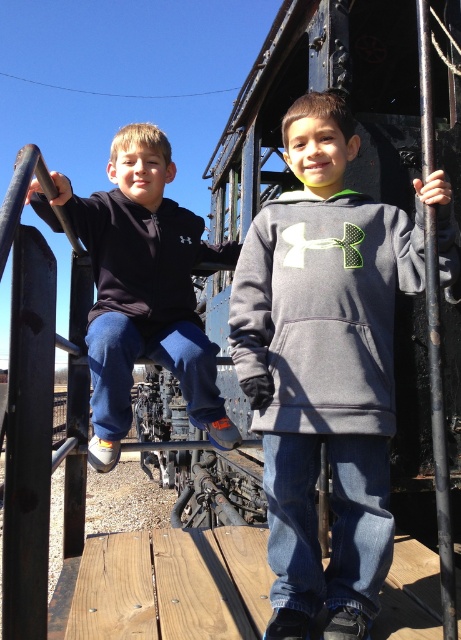
Question: Is gray fleece sweatshirt at center in front of black metal pole at right?

Choices:
 (A) no
 (B) yes

Answer: (A)

Question: Among these objects, which one is nearest to the camera?

Choices:
 (A) gray fleece sweatshirt at center
 (B) black matte sweatshirt at left

Answer: (A)

Question: Is gray fleece sweatshirt at center above black matte sweatshirt at left?

Choices:
 (A) no
 (B) yes

Answer: (A)

Question: Among these objects, which one is farthest from the camera?

Choices:
 (A) black matte sweatshirt at left
 (B) gray fleece hoodie at center
 (C) black metal pole at right
 (D) gray fleece sweatshirt at center

Answer: (A)

Question: Which point appears farthest from the camera in this image?

Choices:
 (A) (326, 422)
 (B) (443, 461)
 (C) (84, 230)
 (D) (166, 337)

Answer: (D)

Question: In this image, where is gray fleece sweatshirt at center located relative to matte black hoodie at left?

Choices:
 (A) left
 (B) right

Answer: (B)